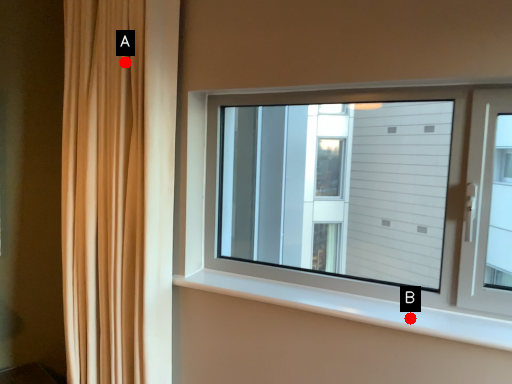
Question: Two points are circled on the image, labeled by A and B beside each circle. Among these points, which one is farthest from the camera?

Choices:
 (A) A is further
 (B) B is further

Answer: (A)